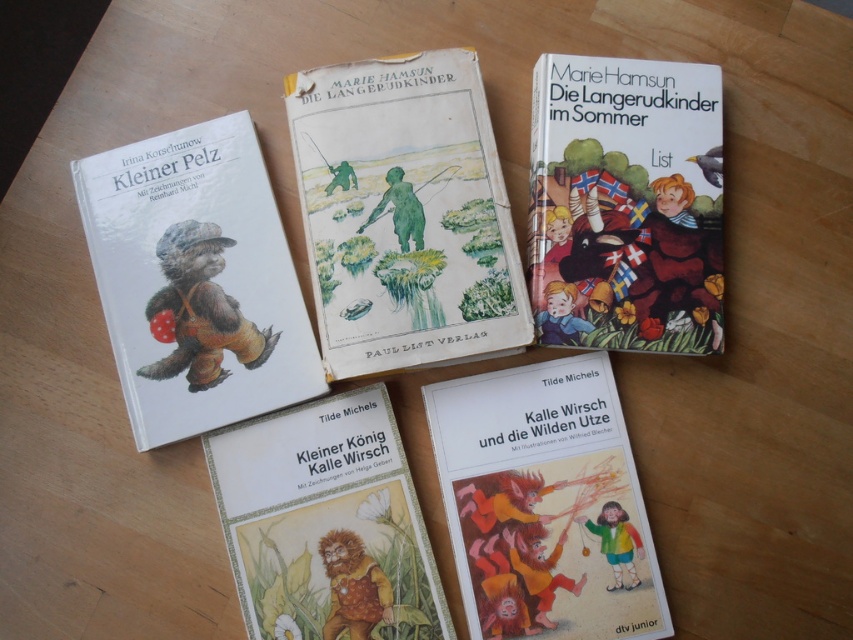
You are organizing a bookshelf and have two items to place side by side. You have a matte brown bear at upper left and a hardcover book at upper right. Which item requires more horizontal space on the shelf?

The matte brown bear at upper left requires more horizontal space on the shelf since its width surpasses that of the hardcover book at upper right.

Consider the image. You are organizing a bookshelf and need to place the matte brown bear at upper left and the hardcover book at upper right. Which one should you place first to maintain their original arrangement?

You should place the matte brown bear at upper left first since it is positioned on the left side of the hardcover book at upper right.

You are organizing books on a shelf and have two books in front of you. The first is a matte paper book at lower center, and the second is a brown paper cover at center. Which one do you need to place first if you want to arrange them from largest to smallest?

The matte paper book at lower center should be placed first because it is larger than the brown paper cover at center.